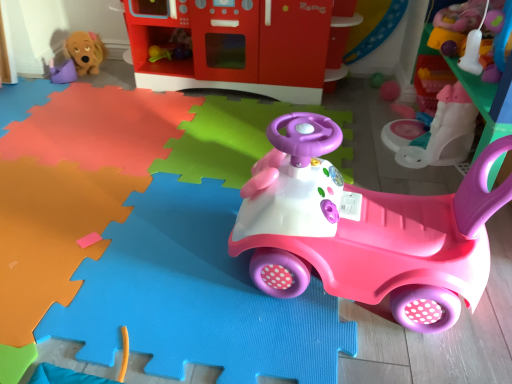
The height and width of the screenshot is (384, 512). Identify the location of vacant space underneath pink plastic walker at upper right, the second toy positioned from the right (from a real-world perspective). (411, 135).